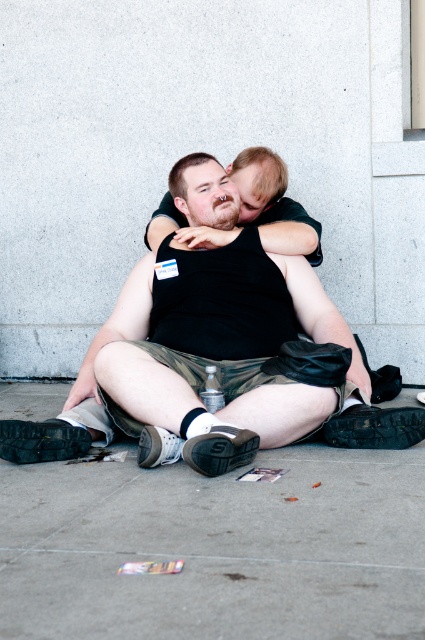
Question: Is gray concrete pavement at lower center bigger than black matte tank top at center?

Choices:
 (A) yes
 (B) no

Answer: (B)

Question: Which is nearer to the gray concrete pavement at lower center?

Choices:
 (A) black matte tank top at center
 (B) smooth black shirt at center

Answer: (A)

Question: Which of these objects is positioned farthest from the black matte tank top at center?

Choices:
 (A) smooth black shirt at center
 (B) gray concrete pavement at lower center

Answer: (B)

Question: Can you confirm if gray concrete pavement at lower center is positioned to the right of black matte tank top at center?

Choices:
 (A) no
 (B) yes

Answer: (A)

Question: Which point is closer to the camera taking this photo?

Choices:
 (A) (311, 253)
 (B) (79, 557)

Answer: (B)

Question: Does gray concrete pavement at lower center appear on the left side of black matte tank top at center?

Choices:
 (A) yes
 (B) no

Answer: (A)